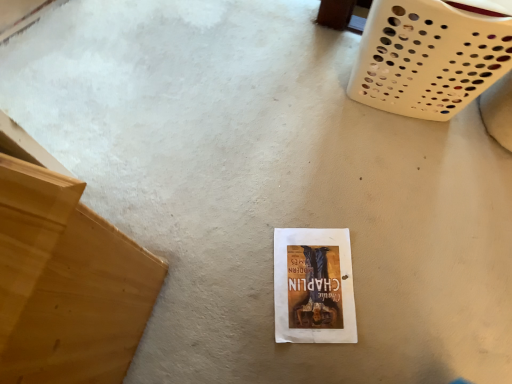
This screenshot has height=384, width=512. Identify the location of free space above white paper at center (from a real-world perspective). (311, 275).